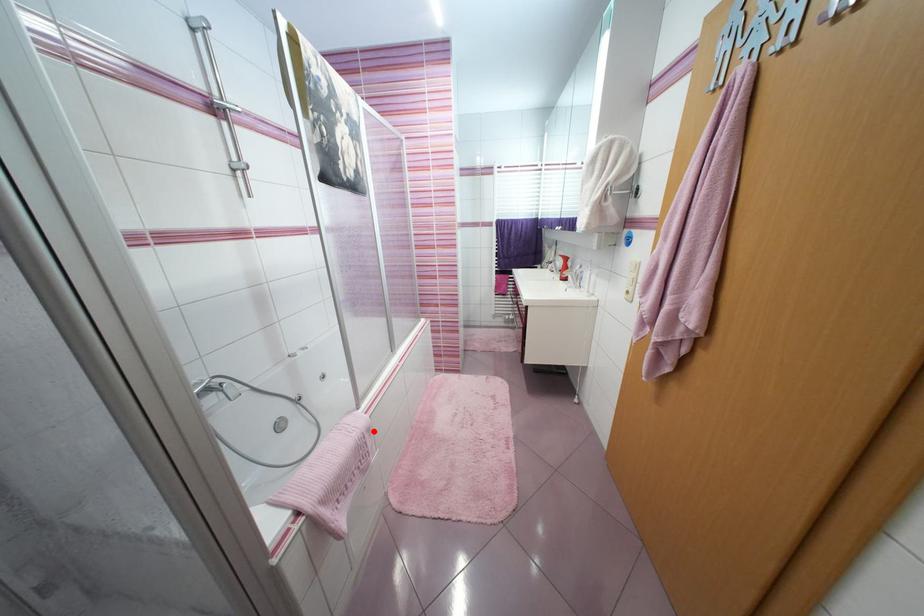
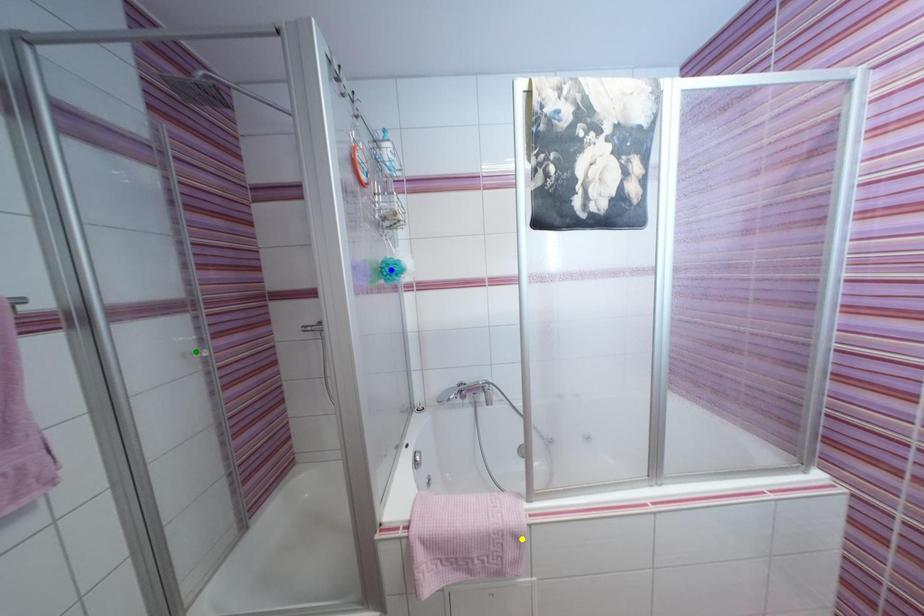
Question: I am providing you with two images of the same scene from different viewpoints. A red point is marked on the first image. You are given multiple points on the second image. Can you choose the point in image 2 that corresponds to the point in image 1?

Choices:
 (A) blue point
 (B) yellow point
 (C) green point

Answer: (B)